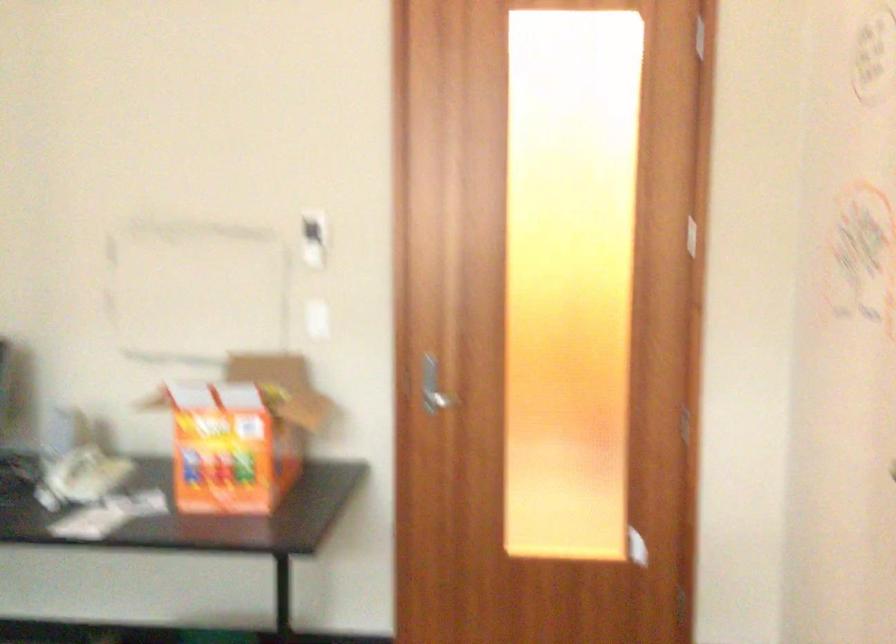
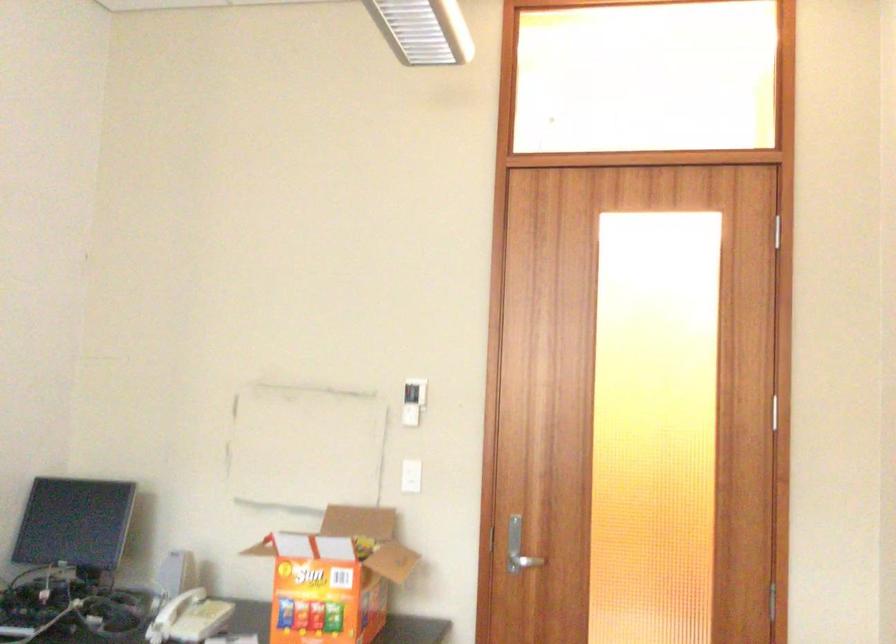
Find the pixel in the second image that matches point 246,428 in the first image.

(334, 576)